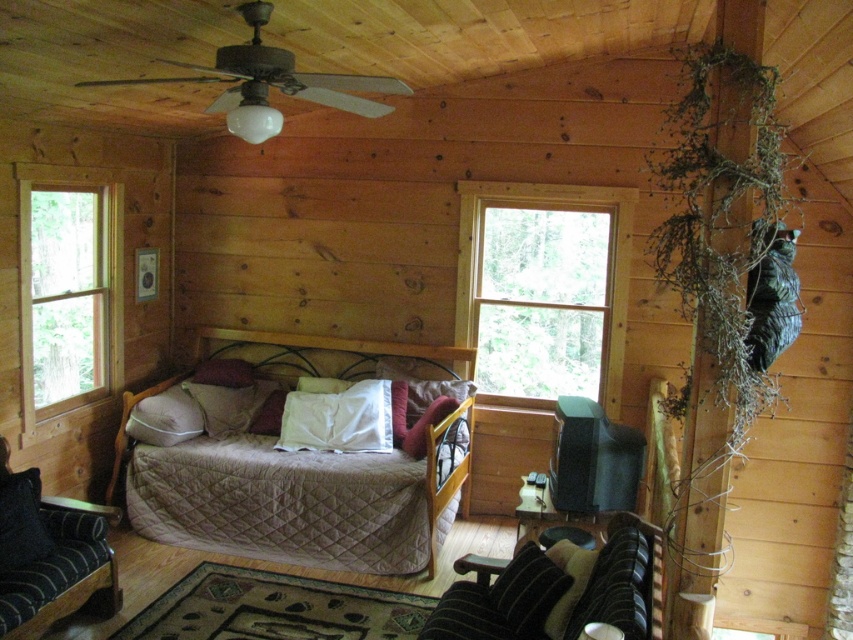
You are standing in the rustic cabin room and want to sit on the clear glass window at left to enjoy the view. However, you notice the quilted beige bed at center is blocking your path. Can you move around the bed to reach the window?

The quilted beige bed at center is positioned on the right side of clear glass window at left, so you can move around the left side of the bed to reach the window.

You are standing in the rustic cabin and want to know the exact position of the clear glass window at upper center. Can you determine its coordinates?

The clear glass window at upper center is located at point (544, 289).

You are standing in the cabin and want to reach the quilted beige bed at center. If your walking speed is 1.2 meters per second, how many seconds will it take you to reach the bed?

The distance between you and the quilted beige bed at center is 3.91 meters. At a speed of 1.2 meters per second, dividing 3.91 by 1.2 gives approximately 3.26 seconds. Therefore, it will take roughly 3.26 seconds to reach the bed.